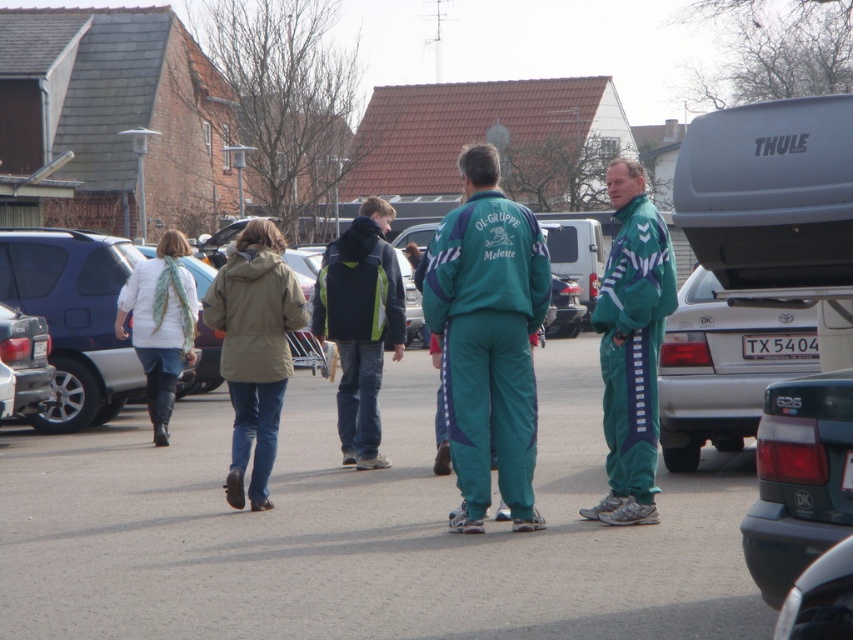
Question: Which object appears closest to the camera in this image?

Choices:
 (A) silver metallic sedan at center right
 (B) dark green plastic car at lower right

Answer: (B)

Question: Which point is closer to the camera?

Choices:
 (A) (554, 476)
 (B) (711, 369)
 (C) (260, 417)
 (D) (467, 296)

Answer: (D)

Question: Which of these objects is positioned farthest from the teal tracksuit at center?

Choices:
 (A) silver metallic sedan at center right
 (B) dark blue jacket at center

Answer: (B)

Question: Does teal tracksuit at center appear under green fabric tracksuit at right?

Choices:
 (A) yes
 (B) no

Answer: (A)

Question: From the image, what is the correct spatial relationship of green fabric tracksuit at right in relation to khaki fabric jacket at lower left?

Choices:
 (A) left
 (B) right

Answer: (B)

Question: Is silver metallic sedan at center right positioned before khaki fabric jacket at lower left?

Choices:
 (A) yes
 (B) no

Answer: (B)